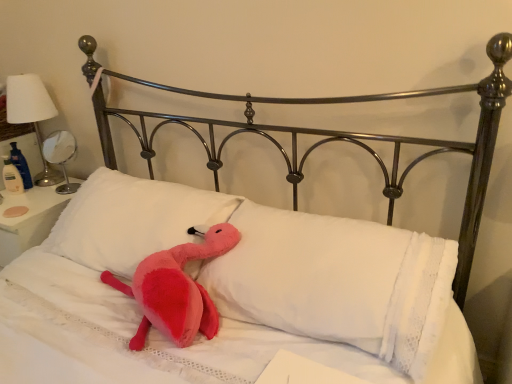
Question: Is white soft pillow at center, which is the second pillow in left-to-right order, in front of white glossy table lamp at left, the second table lamp when ordered from left to right?

Choices:
 (A) yes
 (B) no

Answer: (A)

Question: Does white soft pillow at center, which is the second pillow in left-to-right order, have a greater width compared to white glossy table lamp at left, the second table lamp when ordered from left to right?

Choices:
 (A) yes
 (B) no

Answer: (A)

Question: From a real-world perspective, is white soft pillow at center, which is the second pillow in left-to-right order, located beneath white glossy table lamp at left, the first table lamp positioned from the right?

Choices:
 (A) no
 (B) yes

Answer: (B)

Question: From the image's perspective, is white soft pillow at center, which is the second pillow in left-to-right order, over white glossy table lamp at left, the second table lamp when ordered from left to right?

Choices:
 (A) yes
 (B) no

Answer: (B)

Question: Is the surface of white soft pillow at center, which is the second pillow in left-to-right order, in direct contact with white glossy table lamp at left, the first table lamp positioned from the right?

Choices:
 (A) yes
 (B) no

Answer: (B)

Question: Considering the positions of point (402, 235) and point (60, 187), is point (402, 235) closer or farther from the camera than point (60, 187)?

Choices:
 (A) farther
 (B) closer

Answer: (B)

Question: Is white soft pillow at center, which is the second pillow in left-to-right order, to the left or to the right of white glossy table lamp at left, the first table lamp positioned from the right, in the image?

Choices:
 (A) left
 (B) right

Answer: (B)

Question: From a real-world perspective, relative to white glossy table lamp at left, the first table lamp positioned from the right, is white soft pillow at center, which is the second pillow in left-to-right order, vertically above or below?

Choices:
 (A) below
 (B) above

Answer: (A)

Question: Is white soft pillow at center, which is the second pillow in left-to-right order, bigger or smaller than white glossy table lamp at left, the second table lamp when ordered from left to right?

Choices:
 (A) small
 (B) big

Answer: (B)

Question: From a real-world perspective, relative to metallic silver table lamp at left, which is the first table lamp from left to right, is white soft pillow at center, which is the second pillow in left-to-right order, vertically above or below?

Choices:
 (A) above
 (B) below

Answer: (B)

Question: Is point (321, 256) closer or farther from the camera than point (36, 105)?

Choices:
 (A) closer
 (B) farther

Answer: (A)

Question: Is white soft pillow at center, which ranks as the first pillow in right-to-left order, in front of or behind metallic silver table lamp at left, which is the first table lamp from left to right, in the image?

Choices:
 (A) front
 (B) behind

Answer: (A)

Question: Based on their sizes in the image, would you say white soft pillow at center, which ranks as the first pillow in right-to-left order, is bigger or smaller than metallic silver table lamp at left, which is the first table lamp from left to right?

Choices:
 (A) big
 (B) small

Answer: (A)

Question: Visually, is white soft pillow at center, the first pillow viewed from the left, positioned to the left or to the right of metallic silver table lamp at left, which is the first table lamp from left to right?

Choices:
 (A) left
 (B) right

Answer: (B)

Question: From a real-world perspective, is white soft pillow at center, which is the 2th pillow in right-to-left order, above or below metallic silver table lamp at left, which is the first table lamp from left to right?

Choices:
 (A) below
 (B) above

Answer: (A)